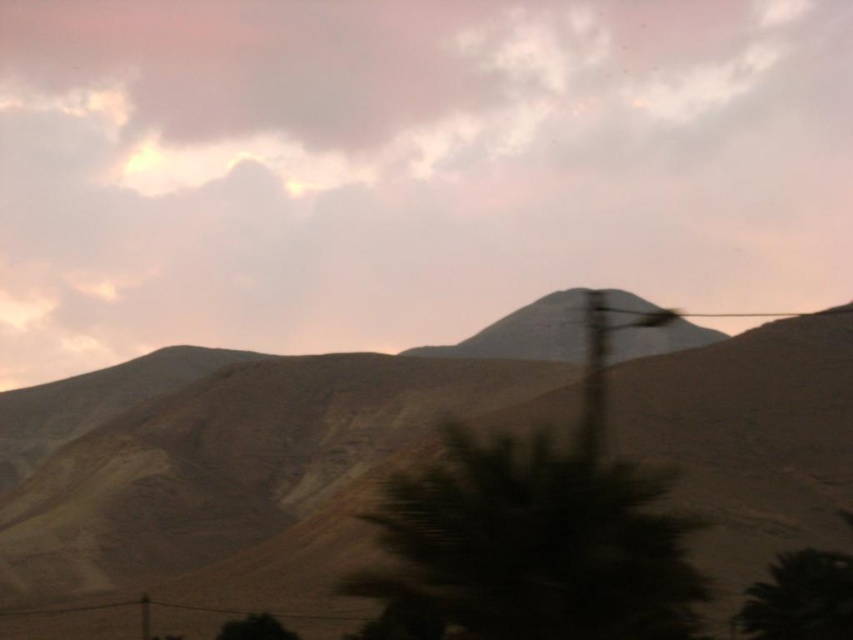
You are an astronomer analyzing the image. You need to locate the smokey pink cloud at upper center. What are its coordinates?

The coordinates of the smokey pink cloud at upper center are at point (x=405, y=166).

You are standing in the desert landscape shown in the image and want to take a photo of the smokey pink cloud at upper center. If your camera has a focal length of 50mm, what is the minimum distance you need to move closer to the cloud to ensure the entire cloud fits within the frame?

The smokey pink cloud at upper center is 57.88 meters away from the camera. To ensure the entire cloud fits within the frame with a 50mm focal length, you would need to calculate the required distance based on the camera sensor size and the cloud dimensions. However, without specific measurements of the cloud or sensor size, an exact distance cannot be determined. Consider using a wider focal length or adjusting your position to frame the cloud appropriately.